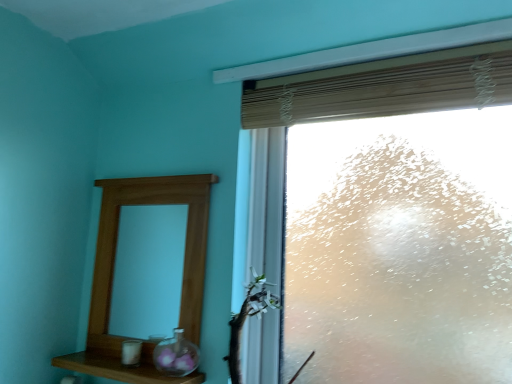
Question: Is green leafy branch at lower right to the right of transparent glass vase at lower center from the viewer's perspective?

Choices:
 (A) no
 (B) yes

Answer: (B)

Question: Is green leafy branch at lower right to the left of transparent glass vase at lower center from the viewer's perspective?

Choices:
 (A) yes
 (B) no

Answer: (B)

Question: Is there a large distance between green leafy branch at lower right and transparent glass vase at lower center?

Choices:
 (A) no
 (B) yes

Answer: (A)

Question: Considering the relative sizes of green leafy branch at lower right and transparent glass vase at lower center in the image provided, is green leafy branch at lower right shorter than transparent glass vase at lower center?

Choices:
 (A) no
 (B) yes

Answer: (A)

Question: Is the depth of green leafy branch at lower right greater than that of transparent glass vase at lower center?

Choices:
 (A) no
 (B) yes

Answer: (A)

Question: From a real-world perspective, is green leafy branch at lower right located beneath transparent glass vase at lower center?

Choices:
 (A) no
 (B) yes

Answer: (A)

Question: Is wooden mirror at left not close to wooden shelf at lower left?

Choices:
 (A) no
 (B) yes

Answer: (A)

Question: Is wooden mirror at left in contact with wooden shelf at lower left?

Choices:
 (A) no
 (B) yes

Answer: (A)

Question: Does wooden mirror at left have a smaller size compared to wooden shelf at lower left?

Choices:
 (A) no
 (B) yes

Answer: (A)

Question: Is wooden mirror at left positioned before wooden shelf at lower left?

Choices:
 (A) yes
 (B) no

Answer: (B)

Question: Considering the relative sizes of wooden mirror at left and wooden shelf at lower left in the image provided, is wooden mirror at left thinner than wooden shelf at lower left?

Choices:
 (A) yes
 (B) no

Answer: (A)

Question: Is the depth of wooden mirror at left greater than that of wooden shelf at lower left?

Choices:
 (A) no
 (B) yes

Answer: (B)

Question: Is wooden mirror at left bigger than green leafy branch at lower right?

Choices:
 (A) no
 (B) yes

Answer: (A)